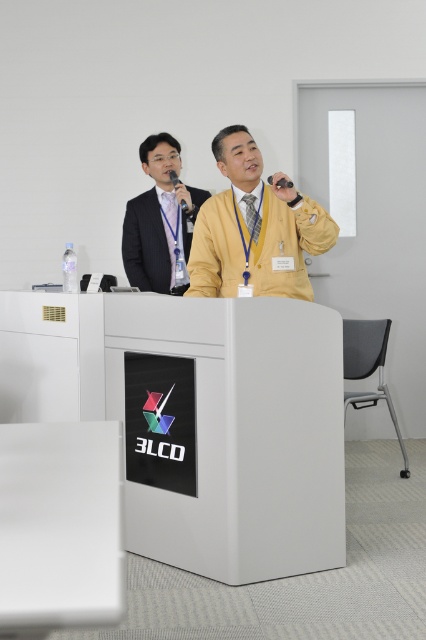
You are an event organizer setting up a presentation area. You have two microphones, the matte black microphone at upper center and the black matte microphone at upper center. Which microphone is positioned higher?

The matte black microphone at upper center is positioned higher than the black matte microphone at upper center according to the description.

You are organizing a presentation and need to place a 1.2 meter long laptop on the table. Given the distance between the white matte table at center and the matte black microphone at upper center, will the laptop fit on the table without extending beyond its edges?

The white matte table at center is 1.58 meters away from the matte black microphone at upper center. Since the laptop is only 1.2 meters long, it will fit on the table as long as it is placed appropriately, not extending beyond the table edges.